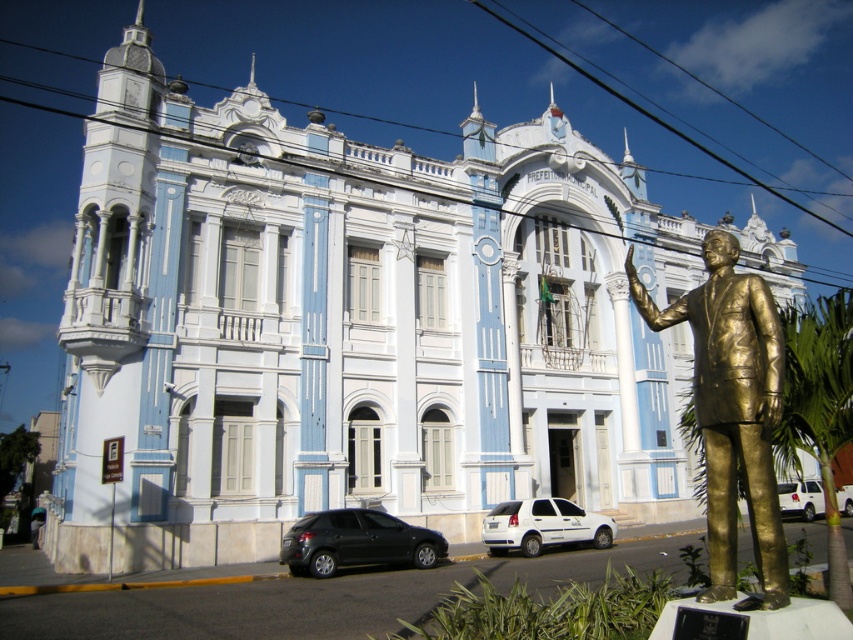
Question: Where is gold-bronze statue at right located in relation to metallic silver car at center in the image?

Choices:
 (A) left
 (B) right

Answer: (A)

Question: Among these objects, which one is farthest from the camera?

Choices:
 (A) metallic silver car at center
 (B) gold-bronze statue at right

Answer: (A)

Question: Is matte black hatchback at lower center thinner than white matte car at center?

Choices:
 (A) no
 (B) yes

Answer: (A)

Question: Estimate the real-world distances between objects in this image. Which object is farther from the matte black hatchback at lower center?

Choices:
 (A) white matte car at center
 (B) gold-bronze statue at right
 (C) white matte car at lower right

Answer: (C)

Question: Which point appears farthest from the camera in this image?

Choices:
 (A) (836, 488)
 (B) (311, 547)
 (C) (515, 516)
 (D) (795, 481)

Answer: (A)

Question: Observing the image, what is the correct spatial positioning of gold-bronze statue at right in reference to metallic silver car at center?

Choices:
 (A) below
 (B) above

Answer: (B)